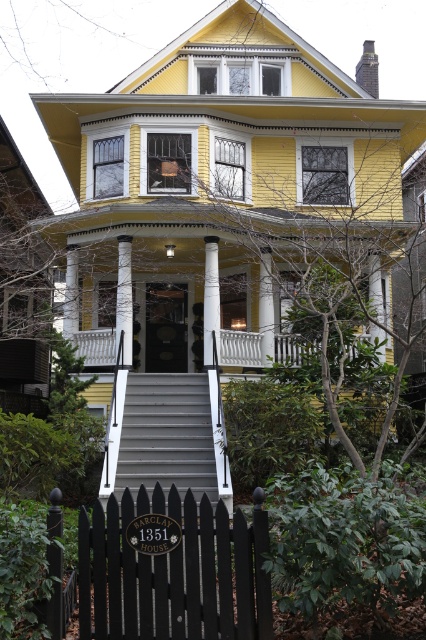
Based on the photo, you are standing at the bottom of the smooth gray stairs at center and want to enter the house. Which direction should you walk to reach the white painted wood porch at center?

You should walk forward because the smooth gray stairs at center is in front of the white painted wood porch at center, so moving forward towards the stairs will lead you to the porch.

You are standing at the base of the house steps and want to determine which of the two points, point (192, 419) or point (227, 365), is closer to you. Based on the house structure described, which point is nearer?

Point (192, 419) is closer to the viewer than point (227, 365).

You are a delivery person trying to see if you can spot the house number on the fence from the street. The house number is on the black wood picket fence at lower left. Is the house number visible over the white painted wood balustrade at center?

The black wood picket fence at lower left is taller than the white painted wood balustrade at center, so the house number on the fence should be visible over the balustrade.